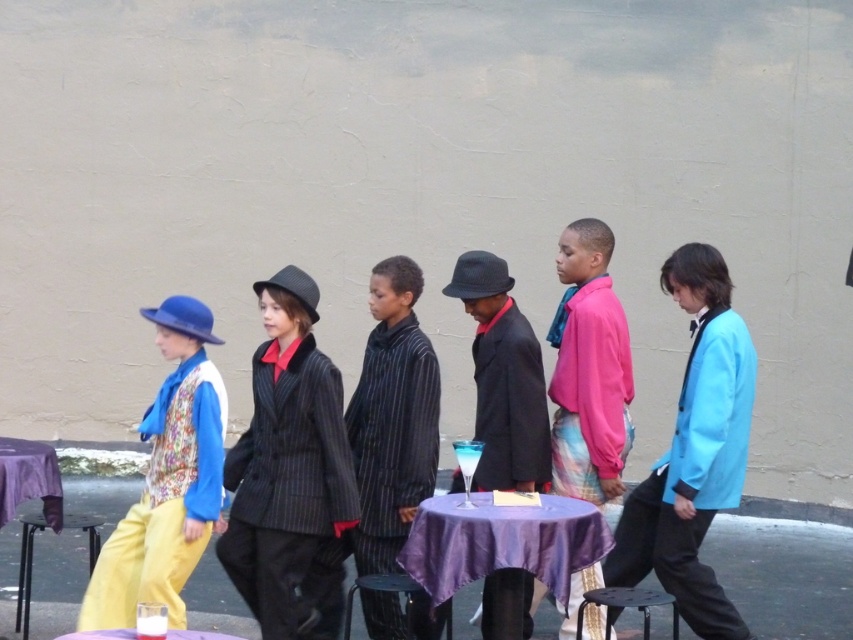
Describe the element at coordinates (694, 452) in the screenshot. The height and width of the screenshot is (640, 853). I see `light blue satin blazer at center` at that location.

Does light blue satin blazer at center appear on the left side of floral fabric vest at left?

No, light blue satin blazer at center is not to the left of floral fabric vest at left.

The width and height of the screenshot is (853, 640). Identify the location of light blue satin blazer at center. (694, 452).

Who is positioned more to the right, light blue satin blazer at center or purple fabric table at center?

From the viewer's perspective, light blue satin blazer at center appears more on the right side.

Which is below, light blue satin blazer at center or purple fabric table at center?

purple fabric table at center is lower down.

Between point (746, 401) and point (114, 634), which one is positioned in front?

Point (114, 634) is in front.

This screenshot has height=640, width=853. Find the location of `light blue satin blazer at center`. light blue satin blazer at center is located at coordinates (694, 452).

Based on the photo, does floral fabric vest at left have a greater height compared to purple fabric table at center?

Correct, floral fabric vest at left is much taller as purple fabric table at center.

Which is in front, point (173, 492) or point (225, 636)?

Positioned in front is point (173, 492).

The width and height of the screenshot is (853, 640). I want to click on floral fabric vest at left, so click(x=167, y=480).

The width and height of the screenshot is (853, 640). Find the location of `floral fabric vest at left`. floral fabric vest at left is located at coordinates (167, 480).